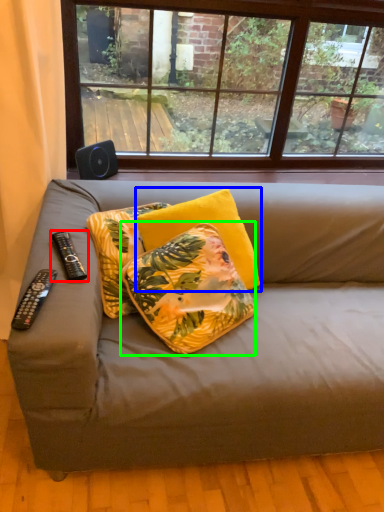
Question: Considering the real-world distances, which object is closest to remote control (highlighted by a red box)? pillow (highlighted by a blue box) or pillow (highlighted by a green box).

Choices:
 (A) pillow
 (B) pillow

Answer: (B)